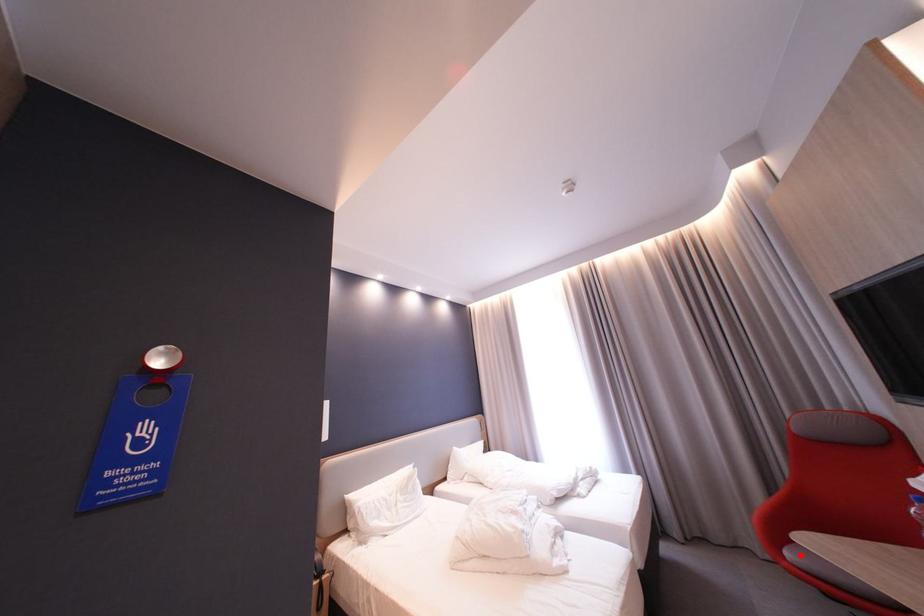
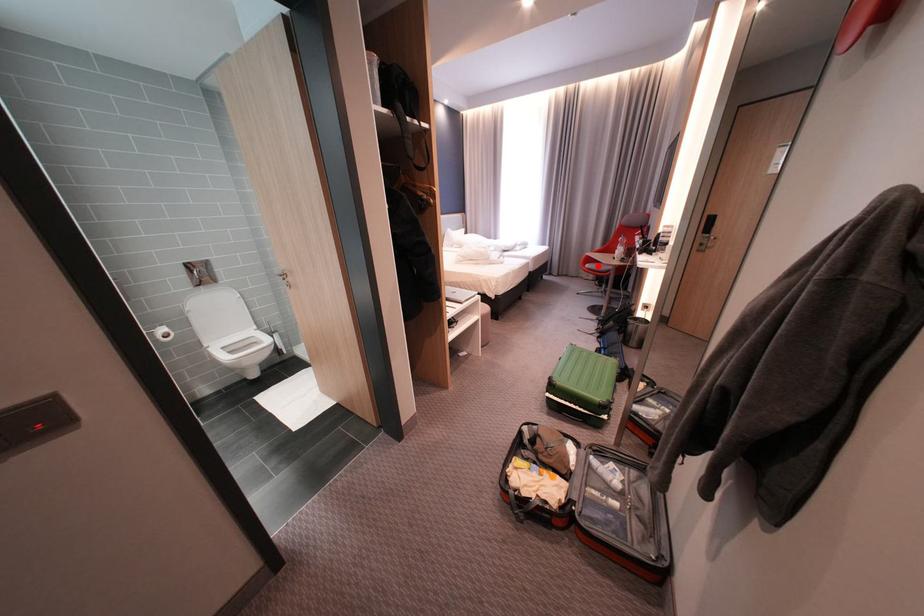
I am providing you with two images of the same scene from different viewpoints. A red point is marked on the first image and another point is marked on the second image. Is the marked point in image1 the same physical position as the marked point in image2?

Yes